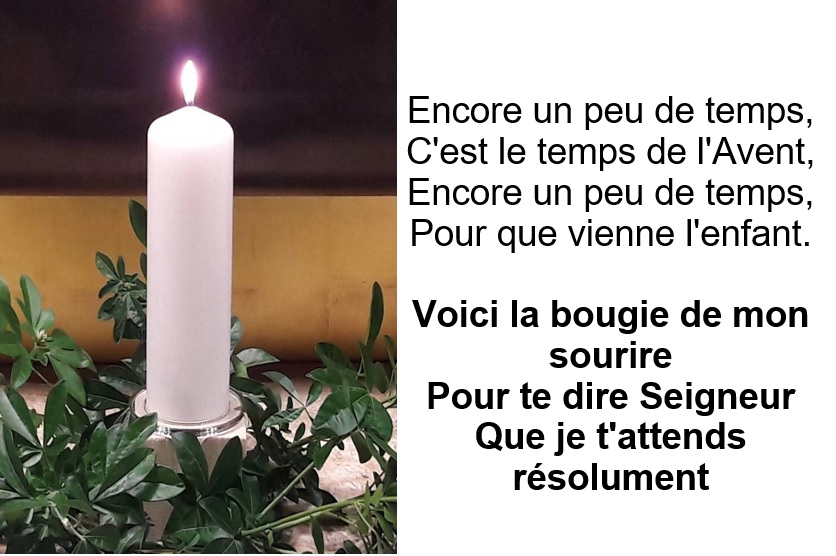
Locate an element on the screen. The image size is (836, 556). white candle is located at coordinates (194, 242).